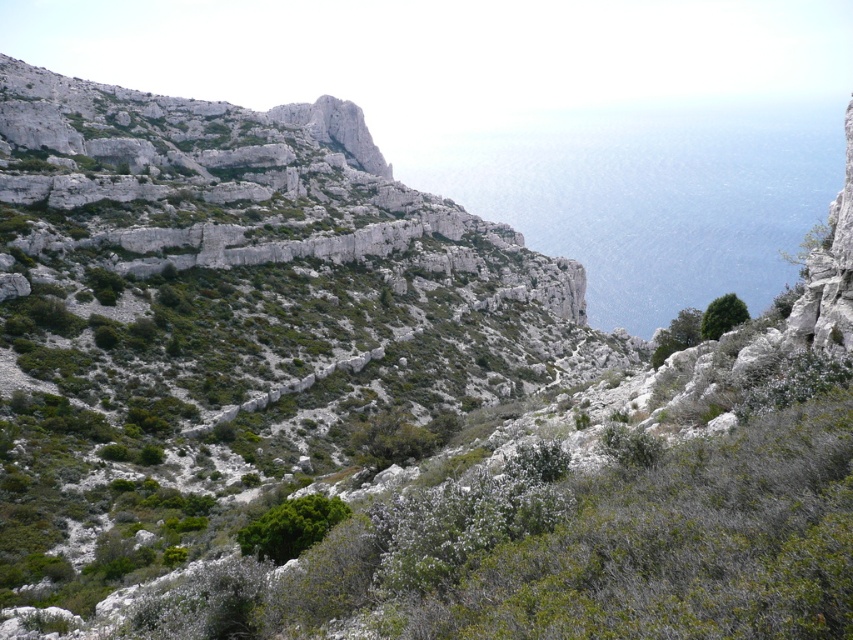
Question: Among these objects, which one is farthest from the camera?

Choices:
 (A) green leafy bush at center
 (B) green leafy bush at upper right

Answer: (B)

Question: Which point is closer to the camera?

Choices:
 (A) green leafy bush at upper right
 (B) green leafy bush at center

Answer: (B)

Question: Is green leafy bush at center bigger than green leafy bush at upper right?

Choices:
 (A) no
 (B) yes

Answer: (A)

Question: In this image, where is green leafy bush at center located relative to green leafy bush at upper right?

Choices:
 (A) below
 (B) above

Answer: (A)

Question: Does green leafy bush at center appear over green leafy bush at upper right?

Choices:
 (A) no
 (B) yes

Answer: (A)

Question: Which point is farther from the camera taking this photo?

Choices:
 (A) (711, 308)
 (B) (335, 516)

Answer: (A)